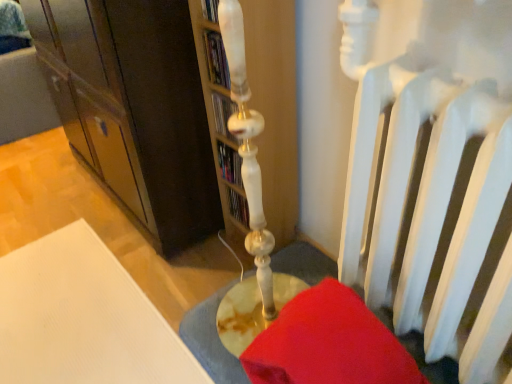
Image resolution: width=512 pixels, height=384 pixels. Find the location of `matte black cabinet at center`. matte black cabinet at center is located at coordinates (134, 107).

Image resolution: width=512 pixels, height=384 pixels. What do you see at coordinates (134, 107) in the screenshot?
I see `matte black cabinet at center` at bounding box center [134, 107].

Measure the distance between matte black cabinet at center and camera.

They are 93.57 centimeters apart.

The image size is (512, 384). In order to click on matte black cabinet at center in this screenshot , I will do `click(134, 107)`.